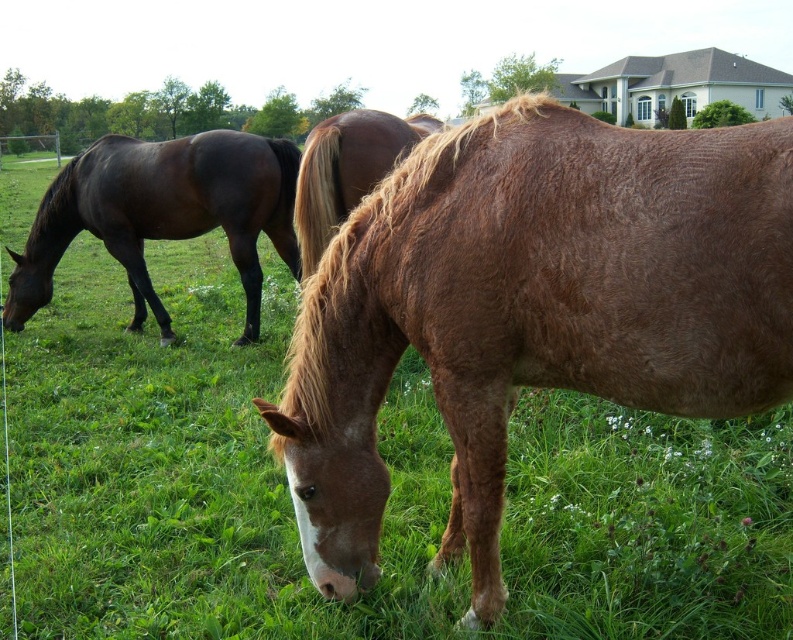
You are a farmer who needs to separate the brown fuzzy horse at center and the shiny dark brown horse at left into two different paddocks. The paddocks are 3 meters apart. Can you place them in separate paddocks without them being able to reach each other?

The distance between the brown fuzzy horse at center and the shiny dark brown horse at left is 3.49 meters. Since the paddocks are 3 meters apart, the horses would still be able to reach each other as 3.49 meters is greater than 3 meters. Therefore, you cannot place them in separate paddocks without them being able to reach each other.